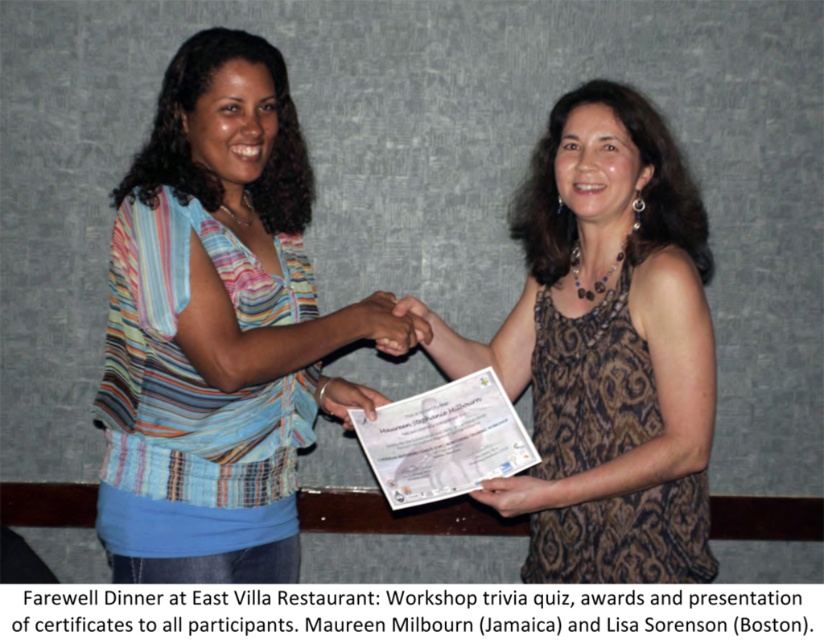
Which is below, striped fabric blouse at center or matte skin at center?

matte skin at center is below.

Is striped fabric blouse at center closer to the viewer compared to matte skin at center?

Yes, it is in front of matte skin at center.

This screenshot has width=824, height=640. I want to click on striped fabric blouse at center, so click(x=213, y=328).

Does striped fabric blouse at center have a larger size compared to brown textured dress at center?

No, striped fabric blouse at center is not bigger than brown textured dress at center.

Which of these two, striped fabric blouse at center or brown textured dress at center, stands taller?

striped fabric blouse at center

Locate an element on the screen. striped fabric blouse at center is located at coordinates (213, 328).

Measure the distance from brown textured dress at center to matte skin at center.

A distance of 12.22 inches exists between brown textured dress at center and matte skin at center.

Is brown textured dress at center smaller than matte skin at center?

Incorrect, brown textured dress at center is not smaller in size than matte skin at center.

Describe the element at coordinates (605, 348) in the screenshot. I see `brown textured dress at center` at that location.

The image size is (824, 640). I want to click on brown textured dress at center, so click(605, 348).